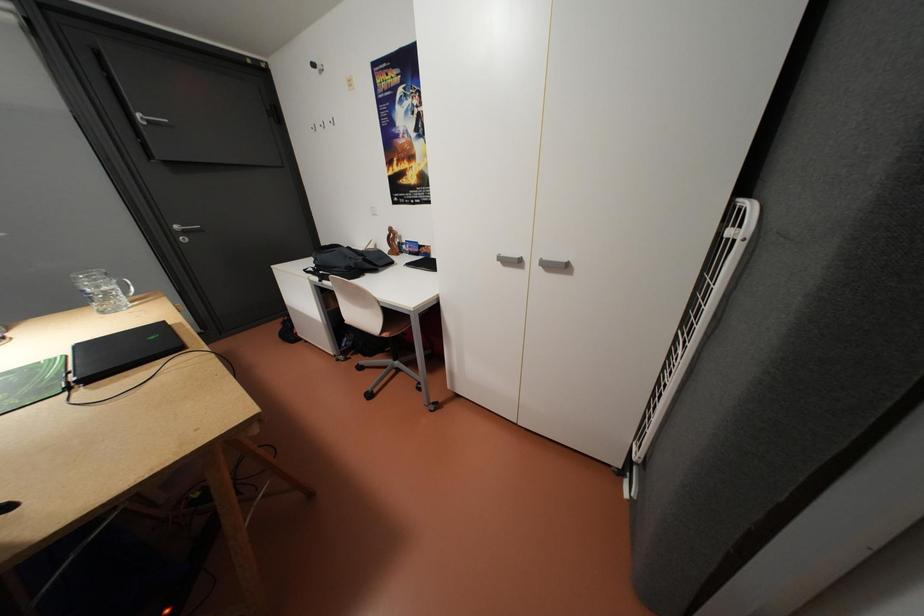
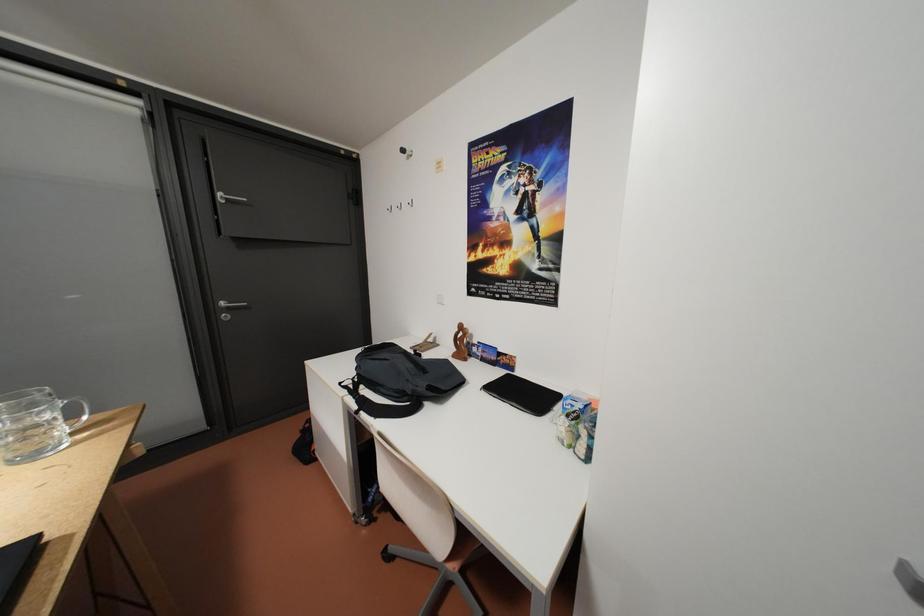
In a continuous first-person perspective shot, in which direction is the camera moving?

The cameraman moved toward left, forward.